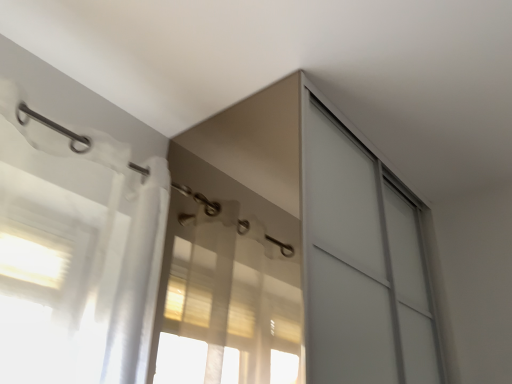
The width and height of the screenshot is (512, 384). Describe the element at coordinates (229, 301) in the screenshot. I see `matte glass window at upper center` at that location.

At what (x,y) coordinates should I click in order to perform the action: click on matte glass window at upper center. Please return your answer as a coordinate pair (x, y). The image size is (512, 384). Looking at the image, I should click on (229, 301).

What is the approximate height of matte glass window at upper center?

matte glass window at upper center is 35.79 inches tall.

You are a GUI agent. You are given a task and a screenshot of the screen. Output one action in this format:
    pyautogui.click(x=<x>, y=<y>)
    Task: Click on the matte glass window at upper center
    
    Given the screenshot: What is the action you would take?
    pyautogui.click(x=229, y=301)